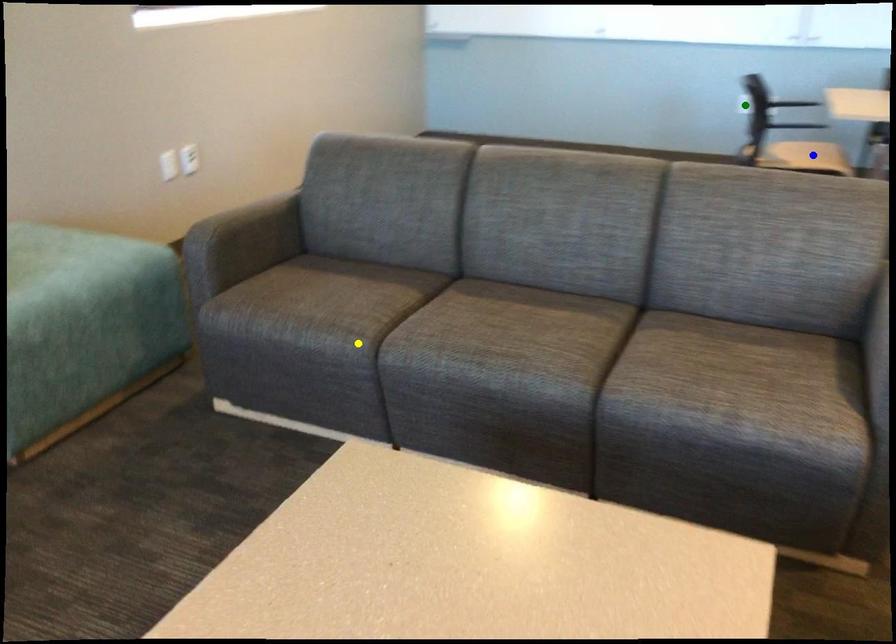
Based on the photo, order these from nearest to farthest:
1. yellow point
2. green point
3. blue point

1. yellow point
2. blue point
3. green point